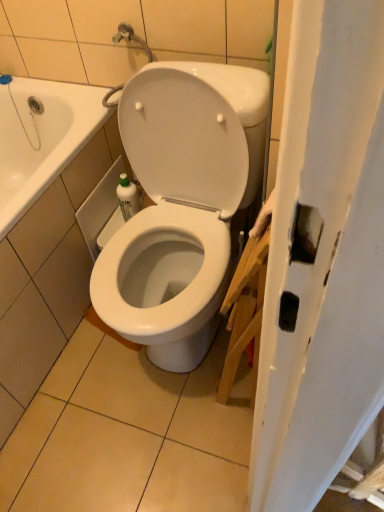
Measure the distance between white glossy toilet at center and camera.

white glossy toilet at center is 37.55 inches away from camera.

Where is `white glossy toilet at center`? The width and height of the screenshot is (384, 512). white glossy toilet at center is located at coordinates (180, 206).

This screenshot has height=512, width=384. Describe the element at coordinates (180, 206) in the screenshot. I see `white glossy toilet at center` at that location.

What is the approximate width of white glossy toilet at center?

It is 25.46 inches.

This screenshot has height=512, width=384. In order to click on white glossy toilet at center in this screenshot , I will do `click(180, 206)`.